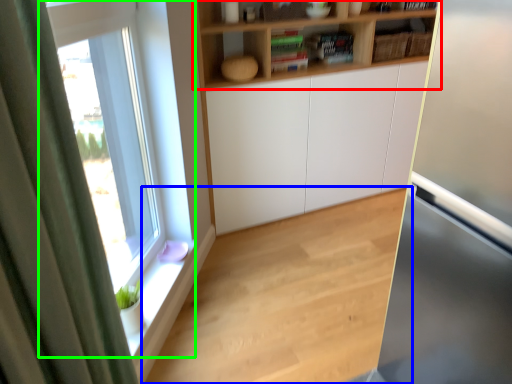
Question: Based on their relative distances, which object is nearer to shelf (highlighted by a red box)? Choose from hardwood (highlighted by a blue box) and window (highlighted by a green box).

Choices:
 (A) hardwood
 (B) window

Answer: (B)